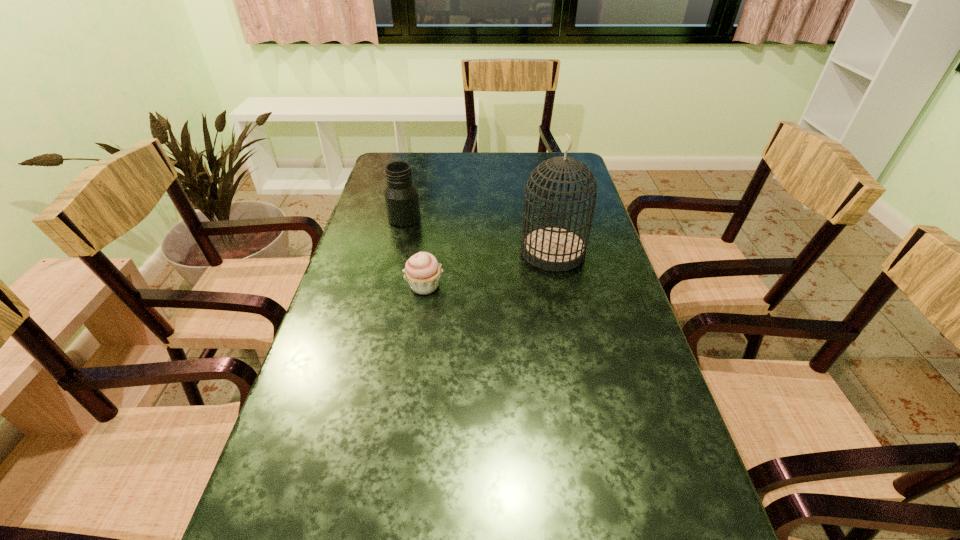
The image size is (960, 540). I want to click on object that is the nearest to the rightmost object, so click(422, 271).

Identify which object is the nearest to the cupcake. Please provide its 2D coordinates. Your answer should be formatted as a tuple, i.e. [(x, y)], where the tuple contains the x and y coordinates of a point satisfying the conditions above.

[(550, 247)]

I want to click on vacant space that satisfies the following two spatial constraints: 1. on the front side of the jar; 2. on the left side of the cupcake, so click(389, 286).

You are a GUI agent. You are given a task and a screenshot of the screen. Output one action in this format:
    pyautogui.click(x=<x>, y=<y>)
    Task: Click on the free space that satisfies the following two spatial constraints: 1. on the front side of the rightmost object; 2. on the left side of the second tallest object
    This screenshot has width=960, height=540.
    Given the screenshot: What is the action you would take?
    pyautogui.click(x=396, y=251)

Locate an element on the screen. The width and height of the screenshot is (960, 540). free space that satisfies the following two spatial constraints: 1. on the front side of the jar; 2. on the right side of the nearest object is located at coordinates (389, 286).